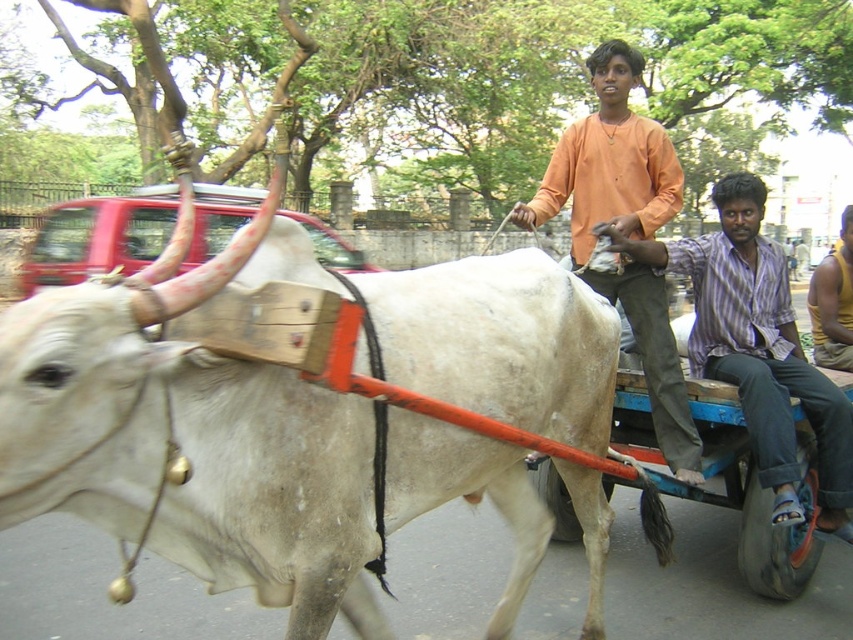
You are a photographer trying to capture both the striped cotton shirt at right and the orange cotton shirt at center in the same frame. Which shirt should you focus on first to ensure both are in the shot?

The striped cotton shirt at right is taller than the orange cotton shirt at center, so focusing on the striped cotton shirt at right first will help ensure both shirts are in the frame.

You are a photographer standing behind the cart and want to take a photo of both the striped cotton shirt at right and orange cotton shirt at center. Can you fit both shirts in the frame without moving the camera?

The distance between the striped cotton shirt at right and orange cotton shirt at center is 20.66 inches. Since the shirts are positioned at different points along the cart, and the photographer is stationary behind the cart, the shirts are likely within the camera frame. However, the exact answer depends on the camera lens and sensor size, which aren